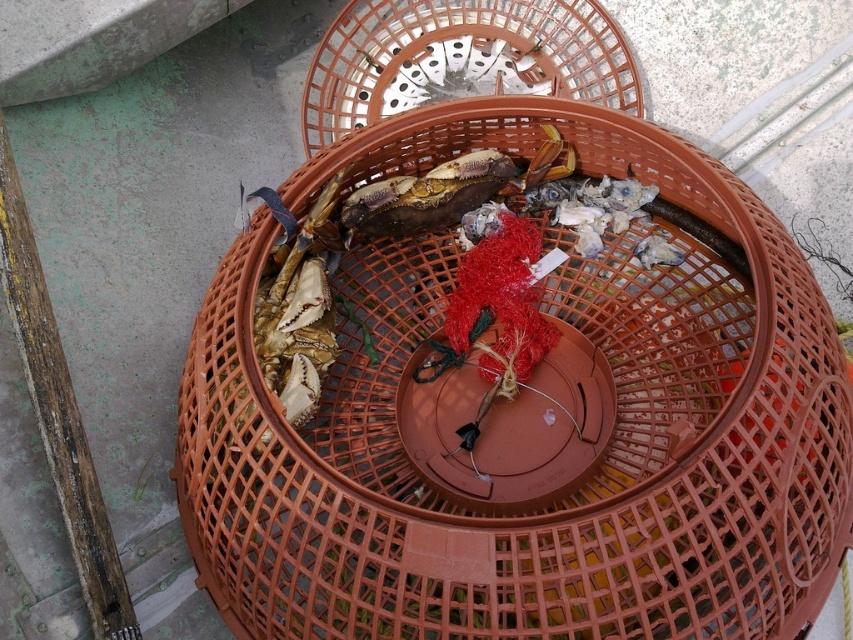
What object is located at the coordinates point (573,480) in the image?

The point (573,480) indicates the brown plastic basket at center.

What are the coordinates of the translucent plastic basket at center?

The translucent plastic basket at center is located at coordinates point (461, 58).